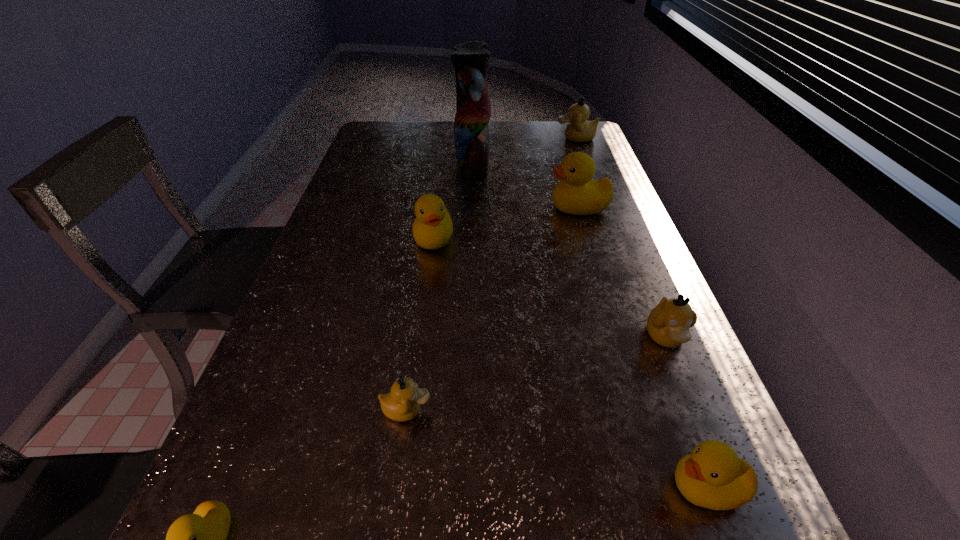
Identify the location of vacant region between the smallest tan duckling and the biggest yellow duckling. The width and height of the screenshot is (960, 540). (492, 308).

Locate an element on the screen. This screenshot has height=540, width=960. vacant space in between the second smallest yellow duckling and the parrot is located at coordinates tap(589, 324).

This screenshot has height=540, width=960. What are the coordinates of `object identified as the closest to the second nearest tan duckling` in the screenshot? It's located at (712, 476).

Locate which object ranks seventh in proximity to the nearest tan duckling. Please provide its 2D coordinates. Your answer should be formatted as a tuple, i.e. [(x, y)], where the tuple contains the x and y coordinates of a point satisfying the conditions above.

[(579, 129)]

The width and height of the screenshot is (960, 540). Find the location of `the third closest duckling to the leftmost duckling`. the third closest duckling to the leftmost duckling is located at coordinates (712, 476).

The width and height of the screenshot is (960, 540). I want to click on duckling that is the second closest one to the sixth nearest duckling, so click(x=579, y=129).

Identify which yellow duckling is located as the fourth nearest to the fourth nearest object. Please provide its 2D coordinates. Your answer should be formatted as a tuple, i.e. [(x, y)], where the tuple contains the x and y coordinates of a point satisfying the conditions above.

[(199, 539)]

Find the location of a particular element. The width and height of the screenshot is (960, 540). yellow duckling object that ranks as the fourth closest to the tallest object is located at coordinates (199, 539).

The width and height of the screenshot is (960, 540). In order to click on tan duckling object that ranks as the closest to the tallest object in this screenshot , I will do `click(579, 129)`.

Locate an element on the screen. This screenshot has height=540, width=960. tan duckling that is the closest to the third farthest object is located at coordinates click(579, 129).